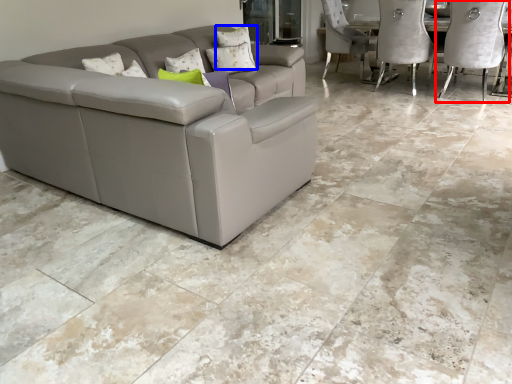
Question: Which object is closer to the camera taking this photo, chair (highlighted by a red box) or pillow (highlighted by a blue box)?

Choices:
 (A) chair
 (B) pillow

Answer: (A)